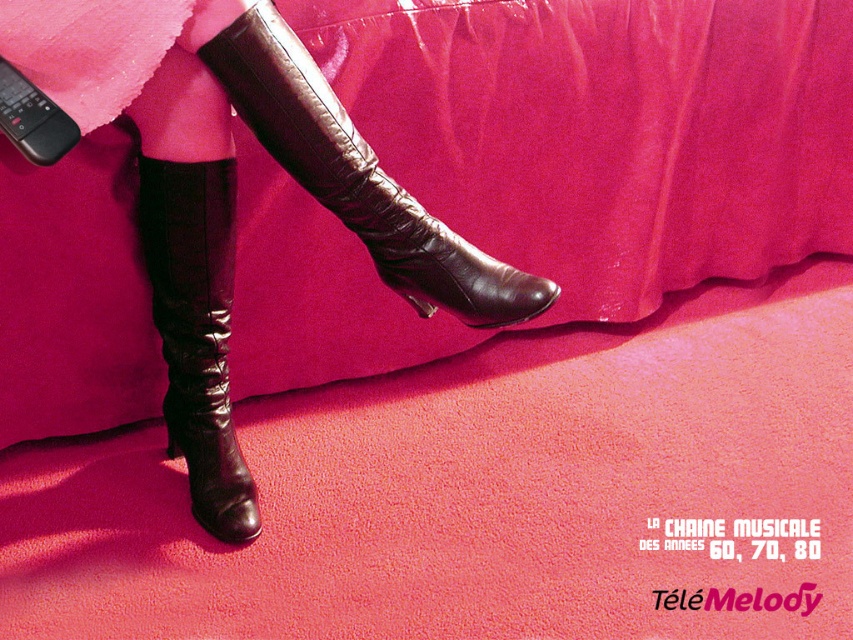
Between velvet pink skirt at upper center and shiny brown leather boot at center, which one has less height?

shiny brown leather boot at center

This screenshot has width=853, height=640. Identify the location of velvet pink skirt at upper center. (606, 132).

Who is more forward, (830, 237) or (316, 195)?

Positioned in front is point (316, 195).

You are a GUI agent. You are given a task and a screenshot of the screen. Output one action in this format:
    pyautogui.click(x=<x>, y=<y>)
    Task: Click on the velvet pink skirt at upper center
    Image resolution: width=853 pixels, height=640 pixels.
    Given the screenshot: What is the action you would take?
    pyautogui.click(x=606, y=132)

The image size is (853, 640). In order to click on velvet pink skirt at upper center in this screenshot , I will do `click(606, 132)`.

Is point (792, 45) positioned behind point (213, 339)?

Yes, point (792, 45) is farther from viewer.

Where is `velvet pink skirt at upper center`? The image size is (853, 640). velvet pink skirt at upper center is located at coordinates (606, 132).

Can you confirm if shiny brown leather boot at center is wider than shiny black boot at lower left?

Yes, shiny brown leather boot at center is wider than shiny black boot at lower left.

Is shiny brown leather boot at center below shiny black boot at lower left?

Incorrect, shiny brown leather boot at center is not positioned below shiny black boot at lower left.

Image resolution: width=853 pixels, height=640 pixels. Describe the element at coordinates (358, 179) in the screenshot. I see `shiny brown leather boot at center` at that location.

This screenshot has width=853, height=640. I want to click on shiny brown leather boot at center, so click(358, 179).